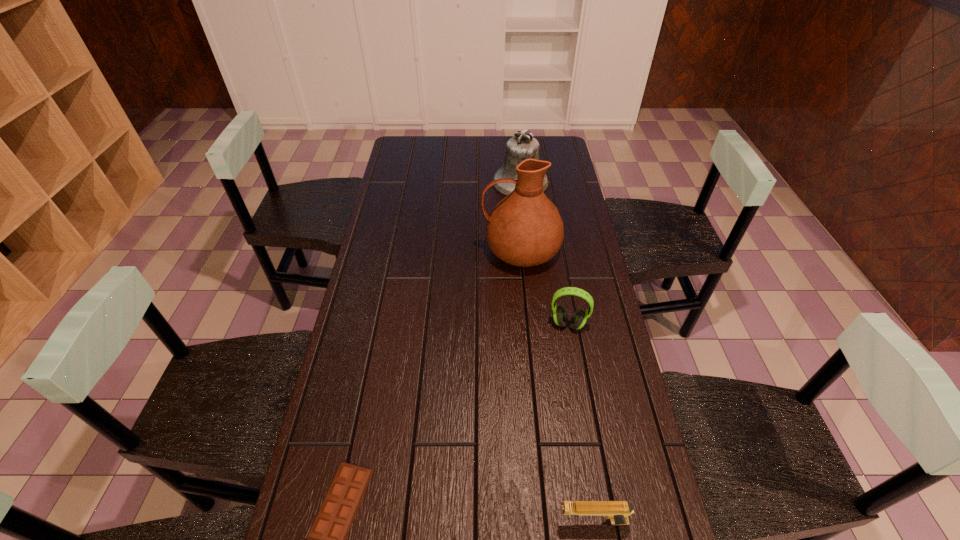
At what (x,y) coordinates should I click in order to perform the action: click on vacant region at the left edge. Please return your answer as a coordinate pair (x, y). Looking at the image, I should click on (348, 352).

Locate an element on the screen. This screenshot has height=540, width=960. free space at the right edge of the desktop is located at coordinates (597, 312).

Identify the location of vacant area at the far left corner of the desktop. The width and height of the screenshot is (960, 540). pos(408,161).

Identify the location of vacant area that lies between the pistol and the second tallest object. The height and width of the screenshot is (540, 960). (557, 351).

The height and width of the screenshot is (540, 960). I want to click on object that is the second closest to the chocolate bar, so click(x=578, y=319).

This screenshot has width=960, height=540. What are the coordinates of `object that is the second closest to the pistol` in the screenshot? It's located at (578, 319).

Locate an element on the screen. free space that satisfies the following two spatial constraints: 1. on the side of the third nearest object with the handle; 2. on the right side of the second farthest object is located at coordinates (527, 324).

The width and height of the screenshot is (960, 540). Identify the location of free space in the image that satisfies the following two spatial constraints: 1. on the side of the second farthest object with the handle; 2. on the left side of the headset. (527, 324).

Where is `blank space that satisfies the following two spatial constraints: 1. on the side of the fourth nearest object with the handle; 2. on the left side of the third shortest object`? Image resolution: width=960 pixels, height=540 pixels. blank space that satisfies the following two spatial constraints: 1. on the side of the fourth nearest object with the handle; 2. on the left side of the third shortest object is located at coordinates (527, 324).

In order to click on free space that satisfies the following two spatial constraints: 1. on the side of the third shortest object with the handle; 2. on the left side of the pitcher in this screenshot , I will do `click(527, 324)`.